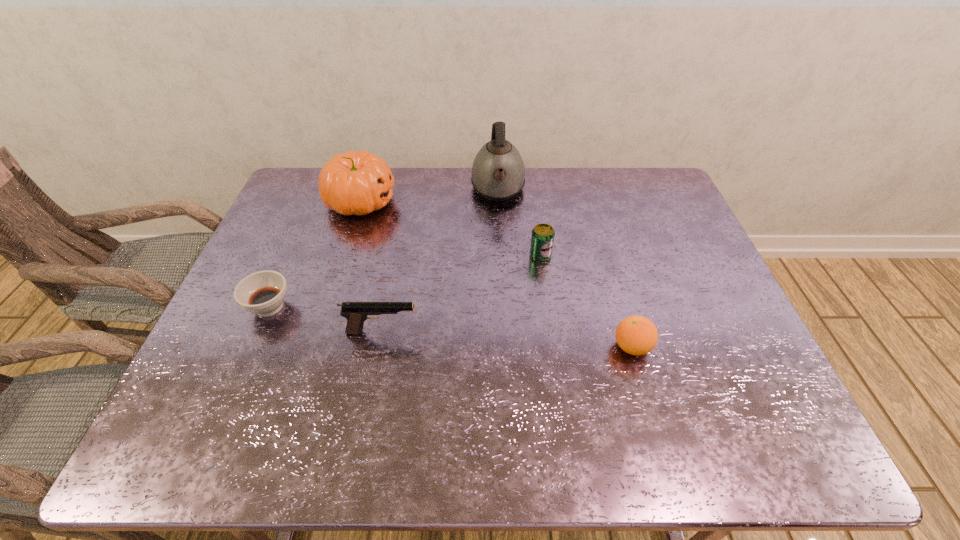
Where is `free area in between the fourth farthest object and the orange`? This screenshot has width=960, height=540. free area in between the fourth farthest object and the orange is located at coordinates (451, 327).

Find the location of a particular element. This screenshot has height=540, width=960. free space between the orange and the pistol is located at coordinates (507, 339).

The width and height of the screenshot is (960, 540). Find the location of `free space between the third farthest object and the tallest object`. free space between the third farthest object and the tallest object is located at coordinates (519, 222).

You are a GUI agent. You are given a task and a screenshot of the screen. Output one action in this format:
    pyautogui.click(x=<x>, y=<y>)
    Task: Click on the second closest object to the third farthest object
    This screenshot has width=960, height=540.
    Given the screenshot: What is the action you would take?
    pyautogui.click(x=636, y=335)

The width and height of the screenshot is (960, 540). I want to click on object that is the second closest one to the tallest object, so click(x=355, y=183).

You are a GUI agent. You are given a task and a screenshot of the screen. Output one action in this format:
    pyautogui.click(x=<x>, y=<y>)
    Task: Click on the vacant area that satisfies the following two spatial constraints: 1. at the muzzle of the pistol; 2. on the back side of the rightmost object
    Image resolution: width=960 pixels, height=540 pixels.
    Given the screenshot: What is the action you would take?
    pyautogui.click(x=379, y=347)

I want to click on vacant space that satisfies the following two spatial constraints: 1. at the muzzle of the pistol; 2. on the right side of the rightmost object, so click(379, 347).

Where is `free space that satisfies the following two spatial constraints: 1. at the spout of the kettle; 2. at the muzzle of the pistol`? Image resolution: width=960 pixels, height=540 pixels. free space that satisfies the following two spatial constraints: 1. at the spout of the kettle; 2. at the muzzle of the pistol is located at coordinates (505, 332).

Locate an element on the screen. The width and height of the screenshot is (960, 540). vacant region that satisfies the following two spatial constraints: 1. on the carved face of the rightmost object; 2. on the left side of the pumpkin is located at coordinates (315, 347).

The width and height of the screenshot is (960, 540). I want to click on blank space that satisfies the following two spatial constraints: 1. at the spout of the tallest object; 2. on the carved face of the pumpkin, so click(498, 201).